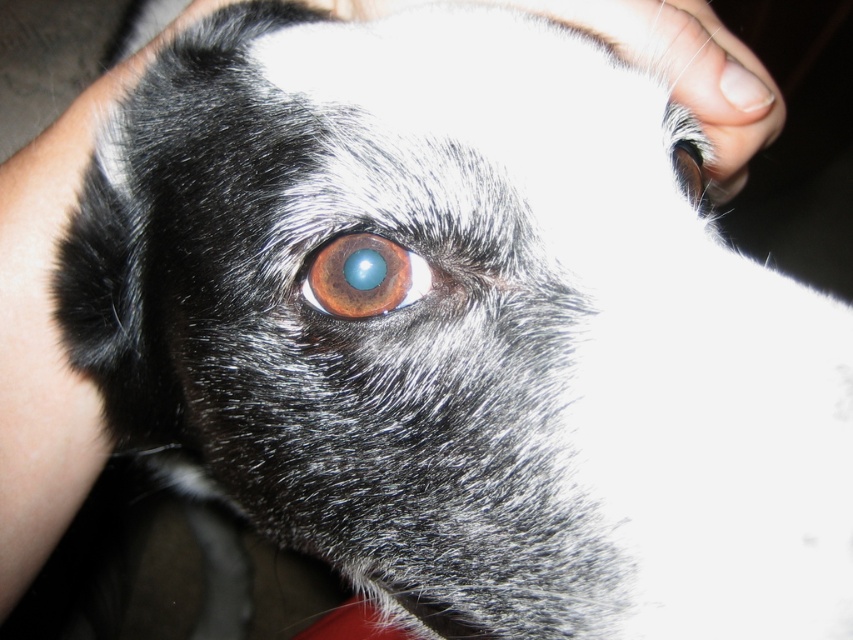
Can you confirm if brown glossy eye at center is thinner than shiny black eye at upper right?

Yes.

Describe the element at coordinates (364, 276) in the screenshot. I see `brown glossy eye at center` at that location.

At what (x,y) coordinates should I click in order to perform the action: click on brown glossy eye at center. Please return your answer as a coordinate pair (x, y). The image size is (853, 640). Looking at the image, I should click on (364, 276).

Which is behind, point (746, 145) or point (692, 177)?

The point (746, 145) is behind.

Which is in front, point (749, 109) or point (699, 164)?

Point (699, 164) is in front.

This screenshot has width=853, height=640. I want to click on white fur at upper center, so click(688, 70).

Can you confirm if white fur at upper center is shorter than brown glossy eye at center?

No, white fur at upper center is not shorter than brown glossy eye at center.

Locate an element on the screen. This screenshot has width=853, height=640. white fur at upper center is located at coordinates (688, 70).

Is point (782, 99) in front of point (329, 278)?

No, (782, 99) is behind (329, 278).

Identify the location of white fur at upper center. The width and height of the screenshot is (853, 640). point(688,70).